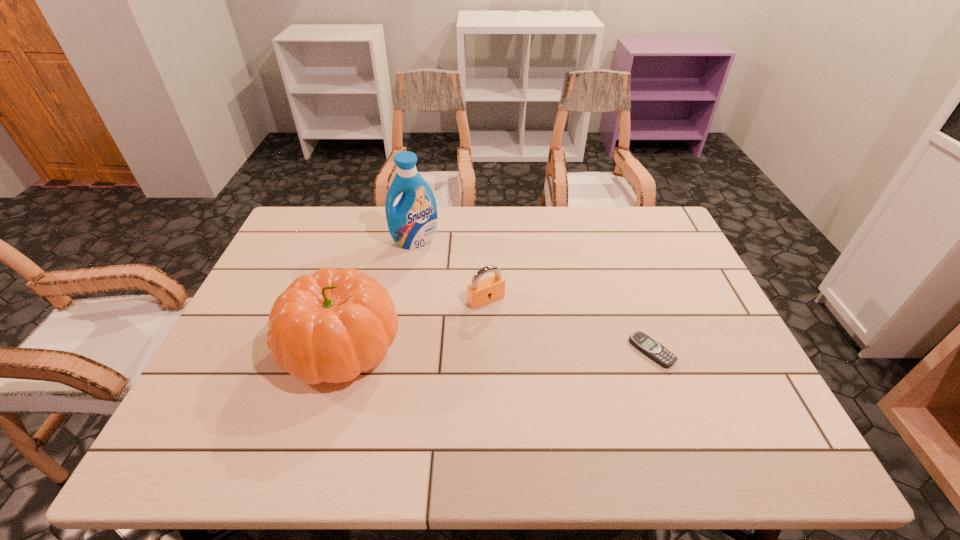
Where is `the closest object to the third object from left to right`? This screenshot has width=960, height=540. the closest object to the third object from left to right is located at coordinates (330, 326).

Identify the location of object that is the third nearest to the detergent. (647, 345).